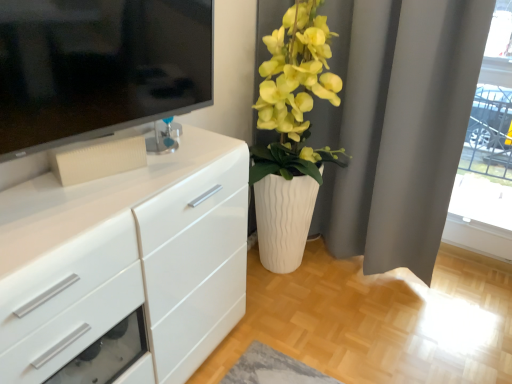
This screenshot has width=512, height=384. Find the location of `vacant region under matte white vase at center right (from a real-world perspective)`. vacant region under matte white vase at center right (from a real-world perspective) is located at coordinates (283, 275).